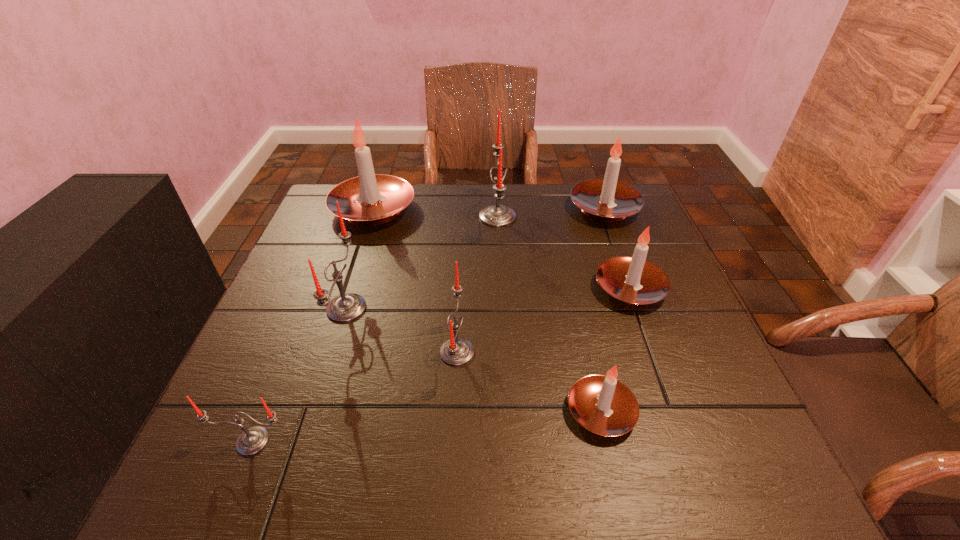
Where is `object located in the near left corner section of the desktop`? object located in the near left corner section of the desktop is located at coordinates (252, 440).

The height and width of the screenshot is (540, 960). Identify the location of object present at the far right corner. (608, 200).

At what (x,y) coordinates should I click in order to perform the action: click on free location at the far edge of the desktop. Please return your answer as a coordinate pair (x, y). Looking at the image, I should click on (568, 186).

Find the location of a particular element. Image resolution: width=960 pixels, height=540 pixels. free location at the near edge of the desktop is located at coordinates (472, 455).

The height and width of the screenshot is (540, 960). In the image, there is a desktop. What are the coordinates of `vacant space at the right edge` in the screenshot? It's located at (625, 253).

The height and width of the screenshot is (540, 960). I want to click on free space between the third smallest red candle and the nearest white candle, so click(473, 360).

Locate an element on the screen. vacant space that is in between the smallest red candle and the smallest white candle is located at coordinates (427, 426).

Locate an element on the screen. The height and width of the screenshot is (540, 960). vacant region between the third smallest red candle and the second smallest white candle is located at coordinates (488, 299).

You are a GUI agent. You are given a task and a screenshot of the screen. Output one action in this format:
    pyautogui.click(x=<x>, y=<y>)
    Task: Click on the blank region between the leftmost white candle and the second biggest red candle
    Image resolution: width=960 pixels, height=540 pixels.
    Given the screenshot: What is the action you would take?
    pyautogui.click(x=360, y=259)

Where is `vacant region between the third farthest white candle and the smallest red candle`? vacant region between the third farthest white candle and the smallest red candle is located at coordinates (442, 365).